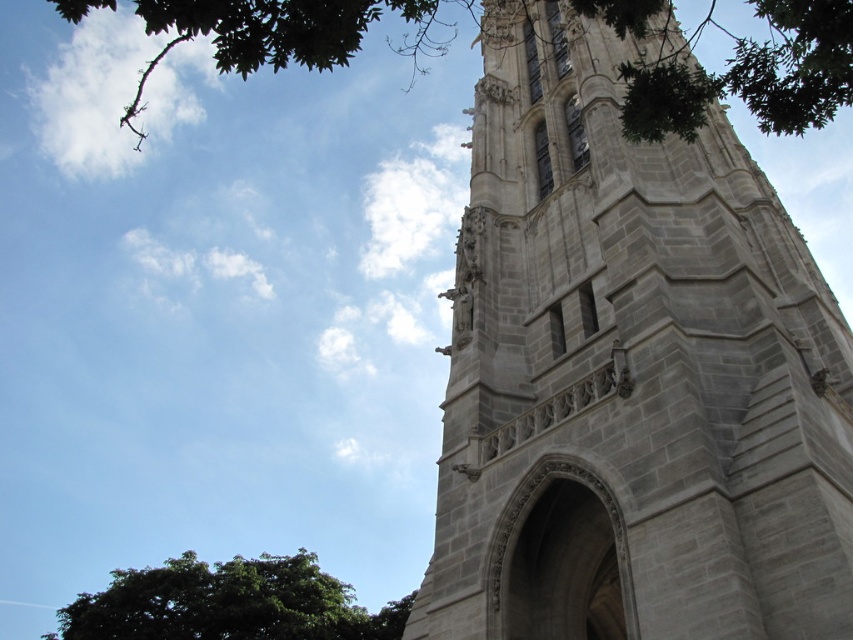
Which is in front, point (703, 376) or point (258, 28)?

Point (258, 28) is more forward.

Between gray stone tower at center and green leafy tree at upper left, which one appears on the left side from the viewer's perspective?

From the viewer's perspective, green leafy tree at upper left appears more on the left side.

Who is more forward, (616, 198) or (229, 28)?

Point (229, 28) is in front.

This screenshot has height=640, width=853. I want to click on gray stone tower at center, so click(630, 376).

How much distance is there between green leafy tree at upper left and green leafy tree at lower left?

A distance of 113.66 meters exists between green leafy tree at upper left and green leafy tree at lower left.

Does green leafy tree at upper left lie in front of green leafy tree at lower left?

Yes, it is in front of green leafy tree at lower left.

The image size is (853, 640). What do you see at coordinates (732, 67) in the screenshot? I see `green leafy tree at upper left` at bounding box center [732, 67].

Identify the location of green leafy tree at upper left. Image resolution: width=853 pixels, height=640 pixels. (732, 67).

In the scene shown: Does gray stone tower at center appear over green leafy tree at lower left?

Yes.

Does gray stone tower at center lie behind green leafy tree at lower left?

No.

Which is behind, point (683, 595) or point (138, 572)?

Point (138, 572)

Identify the location of gray stone tower at center. The height and width of the screenshot is (640, 853). (630, 376).